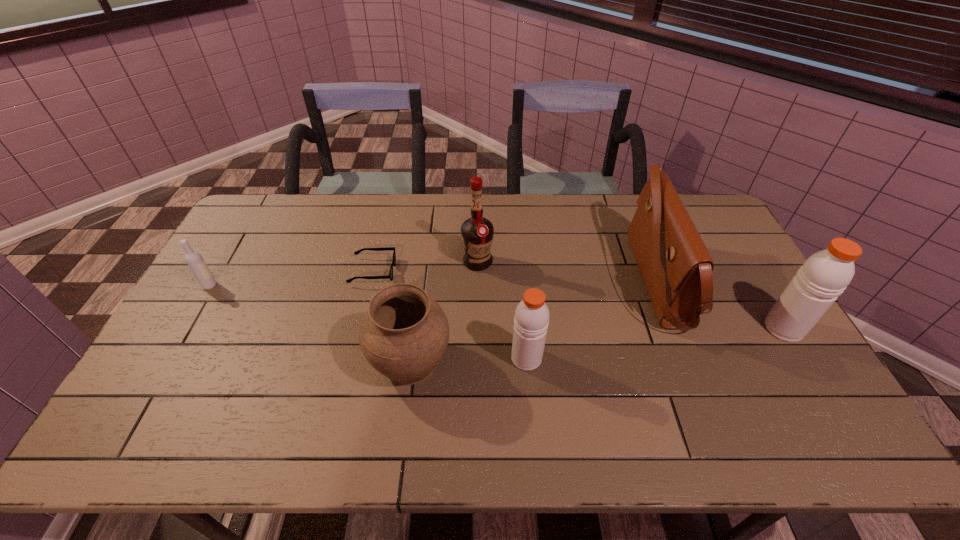
Locate an element on the screen. free spot between the satchel and the shortest object is located at coordinates (516, 276).

Find the location of a particular element. vacant space in between the urn and the right shaker is located at coordinates (597, 345).

Where is `free space that is in between the urn and the taller shaker`? The image size is (960, 540). free space that is in between the urn and the taller shaker is located at coordinates (597, 345).

Identify the location of free point between the spectacles and the nearer shaker. This screenshot has width=960, height=540. (449, 315).

Where is `free space between the spectacles and the vodka`? Image resolution: width=960 pixels, height=540 pixels. free space between the spectacles and the vodka is located at coordinates (292, 278).

I want to click on free point between the liquor and the left shaker, so click(502, 310).

The image size is (960, 540). In order to click on vacant area that lies between the liquor and the taller shaker in this screenshot , I will do `click(631, 295)`.

This screenshot has width=960, height=540. Find the location of `free spot between the farther shaker and the vodka`. free spot between the farther shaker and the vodka is located at coordinates (496, 307).

The image size is (960, 540). Find the location of `vacant point located between the farther shaker and the left shaker`. vacant point located between the farther shaker and the left shaker is located at coordinates (655, 343).

Where is `object that can be found as the third closest to the satchel`? Image resolution: width=960 pixels, height=540 pixels. object that can be found as the third closest to the satchel is located at coordinates (477, 232).